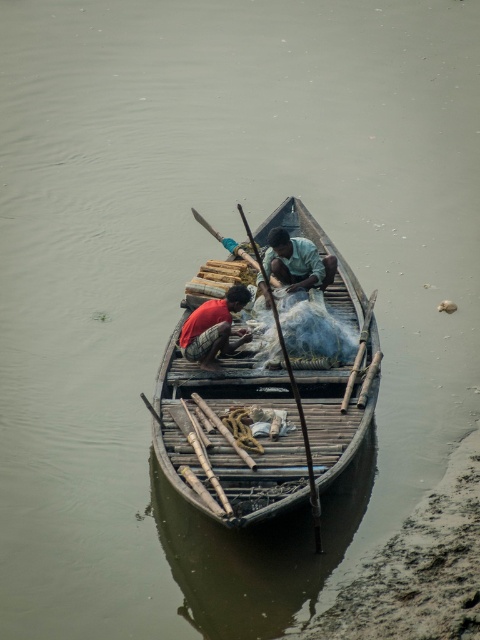
Question: Among these objects, which one is farthest from the camera?

Choices:
 (A) wooden boat at center
 (B) wooden paddle at center
 (C) light blue fabric at center

Answer: (C)

Question: Does wooden boat at center have a smaller size compared to wooden paddle at center?

Choices:
 (A) no
 (B) yes

Answer: (B)

Question: Which object is positioned farthest from the wooden boat at center?

Choices:
 (A) light blue fabric at center
 (B) red fabric shirt at center
 (C) wooden paddle at center

Answer: (A)

Question: Does red fabric shirt at center have a smaller size compared to wooden paddle at center?

Choices:
 (A) no
 (B) yes

Answer: (B)

Question: Is the position of red fabric shirt at center less distant than that of wooden paddle at center?

Choices:
 (A) no
 (B) yes

Answer: (A)

Question: Which point appears closest to the camera in this image?

Choices:
 (A) (305, 248)
 (B) (305, 456)
 (C) (205, 339)

Answer: (B)